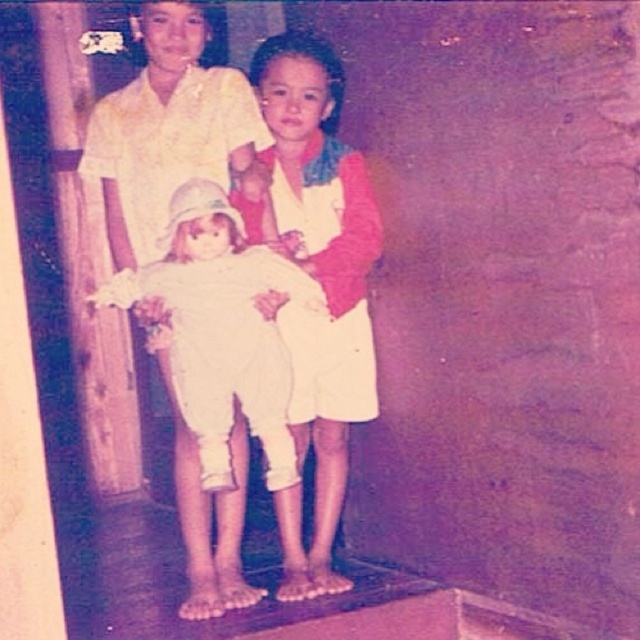
Question: Can you confirm if white cotton dress at center is bigger than white cloth doll at center?

Choices:
 (A) yes
 (B) no

Answer: (A)

Question: Is white cotton dress at center to the right of white cloth doll at center from the viewer's perspective?

Choices:
 (A) yes
 (B) no

Answer: (A)

Question: Among these objects, which one is farthest from the camera?

Choices:
 (A) white cotton dress at center
 (B) white cloth doll at center

Answer: (A)

Question: Which of the following is the farthest from the observer?

Choices:
 (A) (120, 250)
 (B) (275, 58)

Answer: (B)

Question: Where is white cotton dress at center located in relation to white cloth doll at center in the image?

Choices:
 (A) left
 (B) right

Answer: (B)